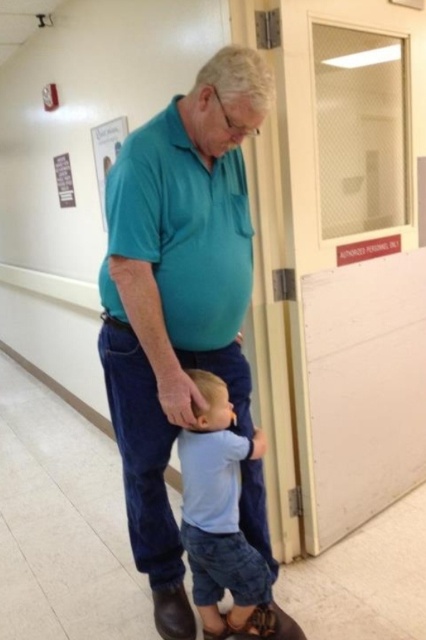
You are an AI security system monitoring the hallway. You notice an individual wearing a teal smooth shirt at center near the door labeled

The teal smooth shirt at center is located at point (178, 296), which is near the authorized personnel only door, so the security system should alert authorities as the individual may be in a restricted area without proper authorization.

From the picture: You are a security camera positioned at the end of the hallway. You observe two points in the scene labeled as point (181, 608) and point (224, 477). Which point is closer to your camera lens?

Point (181, 608) is further to the camera than point (224, 477), so the point closer to the camera lens is point (224, 477).

You are an observer in the hallway. You notice two items in the image, the teal smooth shirt at center and the light blue denim shorts at lower center. Which of these items is taller?

The teal smooth shirt at center is taller than the light blue denim shorts at lower center.